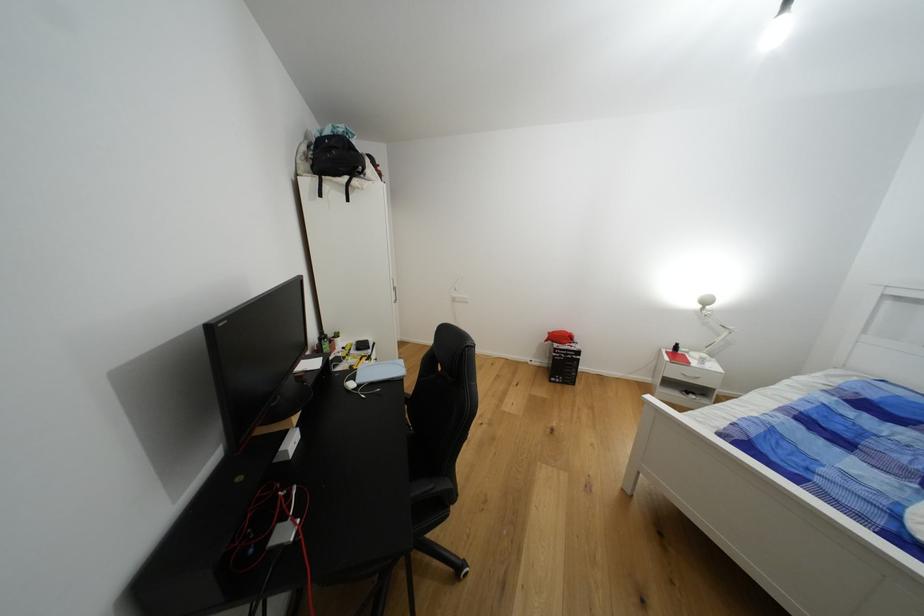
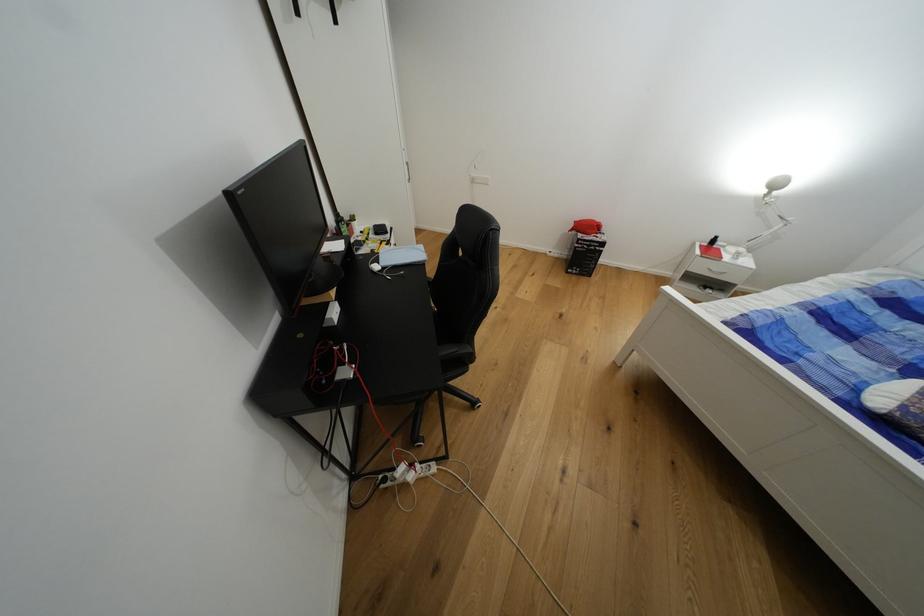
Where in the second image is the point corresponding to the point at 681,374 from the first image?

(707, 268)